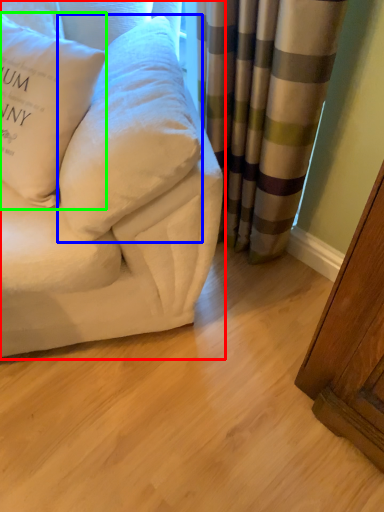
Question: Which object is the farthest from studio couch (highlighted by a red box)? Choose among these: pillow (highlighted by a blue box) or pillow (highlighted by a green box).

Choices:
 (A) pillow
 (B) pillow

Answer: (B)